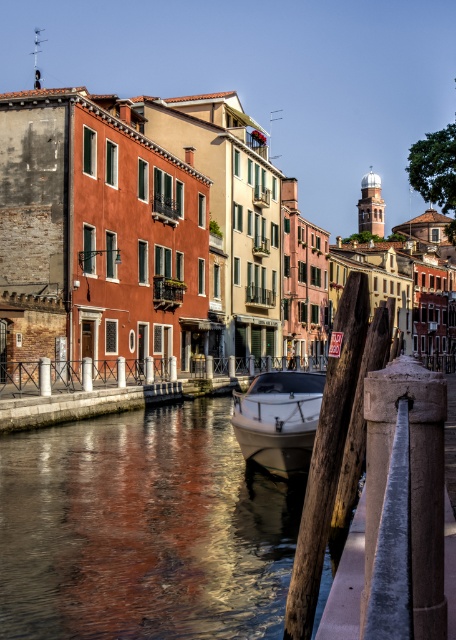
Does glossy water at center appear over white glossy boat at center?

Incorrect, glossy water at center is not positioned above white glossy boat at center.

From the picture: Is glossy water at center taller than white glossy boat at center?

No, glossy water at center is not taller than white glossy boat at center.

Is point (100, 586) less distant than point (264, 404)?

Yes, it is.

The height and width of the screenshot is (640, 456). Identify the location of glossy water at center. (144, 529).

Can you confirm if white glossy boat at center is wider than smooth white railing at center?

In fact, white glossy boat at center might be narrower than smooth white railing at center.

Is point (245, 412) farther from viewer compared to point (259, 364)?

That is False.

What do you see at coordinates (279, 419) in the screenshot? I see `white glossy boat at center` at bounding box center [279, 419].

Find the location of a particular element. The height and width of the screenshot is (640, 456). white glossy boat at center is located at coordinates (279, 419).

I want to click on glossy water at center, so click(144, 529).

Can you confirm if glossy water at center is wider than smooth white railing at center?

No, glossy water at center is not wider than smooth white railing at center.

The height and width of the screenshot is (640, 456). I want to click on glossy water at center, so click(x=144, y=529).